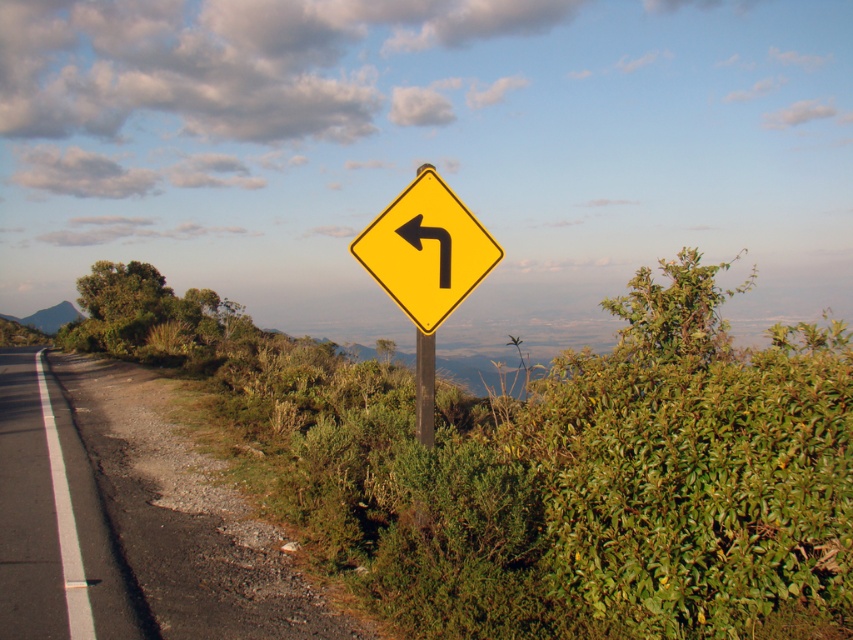
You are driving along the road and see two points marked on your GPS. The first point is at point (239, 630) and the second point is at point (440, 268). According to the image, which point is closer to you as you drive forward?

Point (239, 630) is in front of point (440, 268), so the first point is closer to you as you drive forward.

You are a hiker trying to decide which path to take next. You see a gravel road at left and a green grassy hill at left. Which path is higher in elevation?

The gravel road at left has a greater height compared to the green grassy hill at left, so the gravel road at left is higher in elevation.